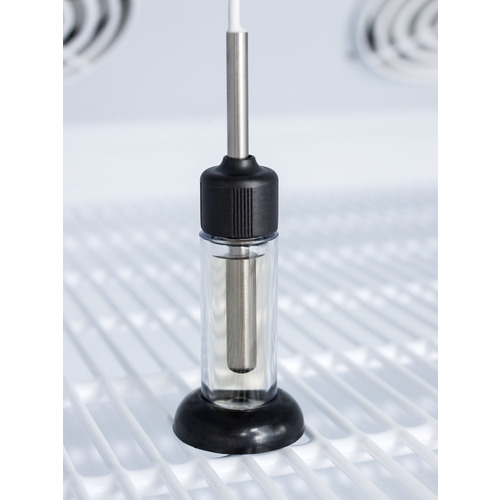
Where is `table`? This screenshot has height=500, width=500. table is located at coordinates (114, 388).